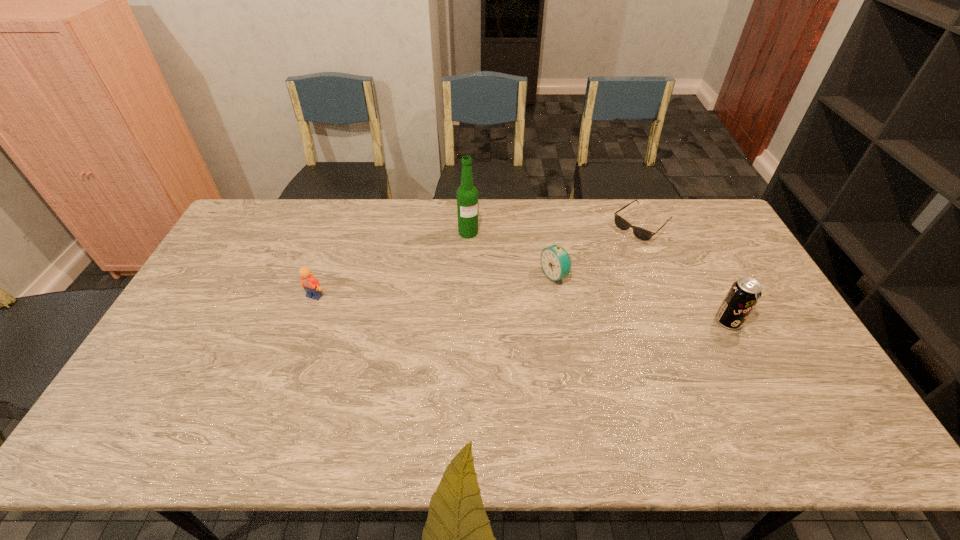
Locate an element on the screen. The image size is (960, 540). beer bottle located in the far edge section of the desktop is located at coordinates (467, 194).

Image resolution: width=960 pixels, height=540 pixels. I want to click on sunglasses present at the far edge, so click(x=642, y=234).

This screenshot has height=540, width=960. Find the location of `object at the right edge`. object at the right edge is located at coordinates (744, 294).

Find the location of a particular element. The width and height of the screenshot is (960, 540). free spot at the far edge of the desktop is located at coordinates point(368,228).

In the image, there is a desktop. In order to click on free region at the near edge in this screenshot , I will do `click(305, 386)`.

In the image, there is a desktop. Find the location of `free region at the left edge`. free region at the left edge is located at coordinates (188, 300).

Find the location of a particular element. The width and height of the screenshot is (960, 540). vacant space at the right edge of the desktop is located at coordinates tap(789, 348).

This screenshot has height=540, width=960. Identify the location of vacant space at the far left corner. [x=237, y=232].

The height and width of the screenshot is (540, 960). I want to click on vacant space at the far right corner of the desktop, so click(682, 229).

This screenshot has width=960, height=540. I want to click on vacant space that is in between the third farthest object and the beer bottle, so click(512, 254).